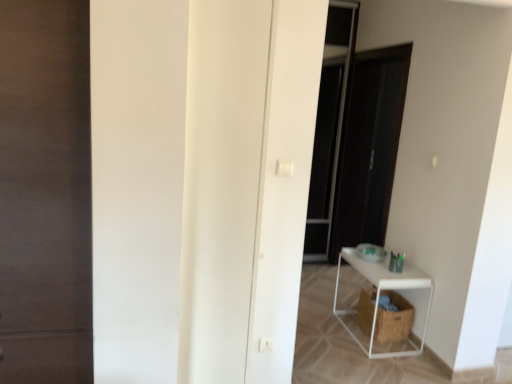
Question: Should I look upward or downward to see white matte door at center, the 1th door in the right-to-left sequence?

Choices:
 (A) down
 (B) up

Answer: (A)

Question: From a real-world perspective, is transparent glass screen door at center over brown woven laundry basket at lower right?

Choices:
 (A) yes
 (B) no

Answer: (A)

Question: Is brown woven laundry basket at lower right a part of transparent glass screen door at center?

Choices:
 (A) no
 (B) yes

Answer: (A)

Question: From a real-world perspective, does transparent glass screen door at center sit lower than brown woven laundry basket at lower right?

Choices:
 (A) yes
 (B) no

Answer: (B)

Question: Considering the relative sizes of transparent glass screen door at center and brown woven laundry basket at lower right in the image provided, is transparent glass screen door at center taller than brown woven laundry basket at lower right?

Choices:
 (A) no
 (B) yes

Answer: (B)

Question: Can you confirm if transparent glass screen door at center is bigger than brown woven laundry basket at lower right?

Choices:
 (A) yes
 (B) no

Answer: (A)

Question: Is transparent glass screen door at center turned away from brown woven laundry basket at lower right?

Choices:
 (A) no
 (B) yes

Answer: (A)

Question: Could you tell me if white matte door at center, the 1th door in the right-to-left sequence, is facing white matte shelf at lower right?

Choices:
 (A) yes
 (B) no

Answer: (B)

Question: Is white matte door at center, the 2th door positioned from the left, not inside white matte shelf at lower right?

Choices:
 (A) no
 (B) yes

Answer: (B)

Question: Is white matte door at center, the 2th door positioned from the left, in front of white matte shelf at lower right?

Choices:
 (A) yes
 (B) no

Answer: (A)

Question: Can you confirm if white matte door at center, the 2th door positioned from the left, is positioned to the right of white matte shelf at lower right?

Choices:
 (A) yes
 (B) no

Answer: (B)

Question: Are white matte door at center, the 2th door positioned from the left, and white matte shelf at lower right located far from each other?

Choices:
 (A) no
 (B) yes

Answer: (B)

Question: From a real-world perspective, is white matte door at center, the 2th door positioned from the left, positioned over white matte shelf at lower right based on gravity?

Choices:
 (A) yes
 (B) no

Answer: (A)

Question: From the image's perspective, does white matte shelf at lower right appear higher than dark wood door at left, which appears as the 2th door when viewed from the right?

Choices:
 (A) no
 (B) yes

Answer: (A)